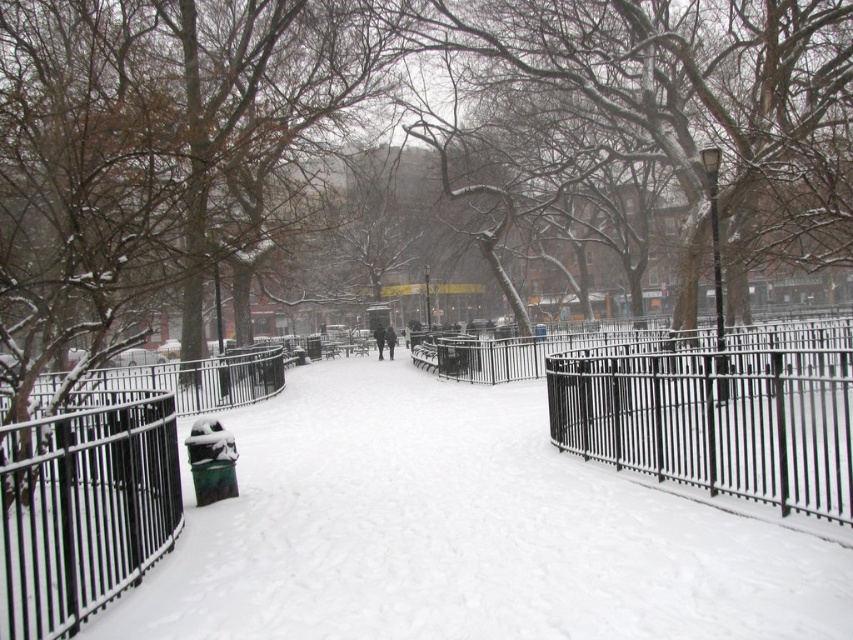
Does black metal fence at center have a smaller size compared to dark gray coat at center?

Incorrect, black metal fence at center is not smaller in size than dark gray coat at center.

From the picture: Can you confirm if black metal fence at center is positioned above dark gray coat at center?

No, black metal fence at center is not above dark gray coat at center.

At what (x,y) coordinates should I click in order to perform the action: click on black metal fence at center. Please return your answer as a coordinate pair (x, y). This screenshot has height=640, width=853. Looking at the image, I should click on (695, 404).

Where is `black metal fence at center`? black metal fence at center is located at coordinates (695, 404).

Can you confirm if white snow-covered pavement at center is bigger than black matte jacket at center?

Yes.

Is point (641, 589) closer to camera compared to point (379, 342)?

Yes, it is.

You are a GUI agent. You are given a task and a screenshot of the screen. Output one action in this format:
    pyautogui.click(x=<x>, y=<y>)
    Task: Click on the white snow-covered pavement at center
    
    Given the screenshot: What is the action you would take?
    pyautogui.click(x=463, y=531)

From the picture: Is black metal fence at center above black matte jacket at center?

Actually, black metal fence at center is below black matte jacket at center.

Is black metal fence at center wider than black matte jacket at center?

Correct, the width of black metal fence at center exceeds that of black matte jacket at center.

Does point (737, 456) lie in front of point (376, 328)?

That is True.

Find the location of `black metal fence at center`. black metal fence at center is located at coordinates (695, 404).